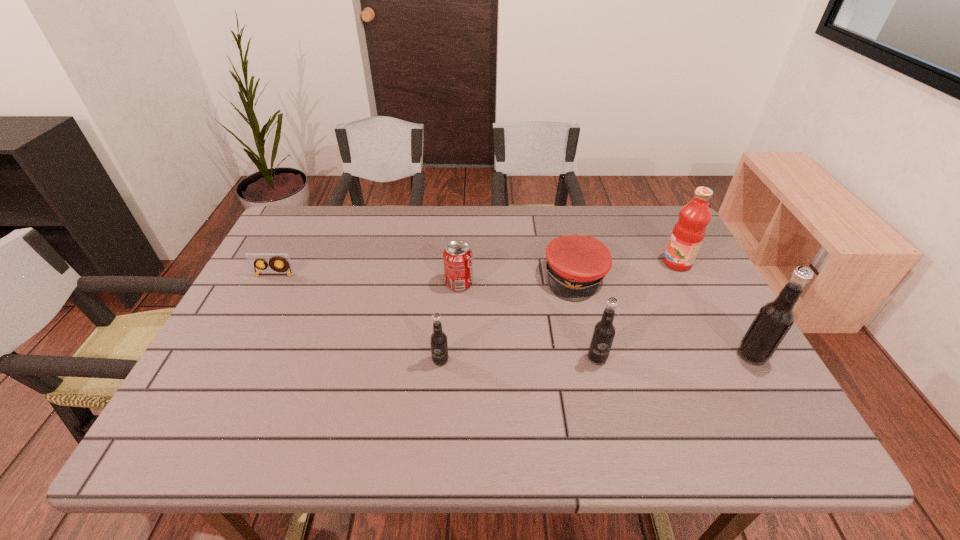
The height and width of the screenshot is (540, 960). In order to click on the shortest root beer in this screenshot , I will do `click(438, 340)`.

Locate an element on the screen. the leftmost root beer is located at coordinates (438, 340).

Find the location of a particular element. The width and height of the screenshot is (960, 540). the second root beer from left to right is located at coordinates (604, 330).

Locate an element on the screen. the fifth shortest object is located at coordinates (604, 330).

Image resolution: width=960 pixels, height=540 pixels. What are the coordinates of `the rightmost root beer` in the screenshot? It's located at (775, 318).

I want to click on the second shortest object, so click(576, 265).

The image size is (960, 540). Identify the location of fruit juice. (689, 231).

Find the location of a particular element. This screenshot has height=540, width=960. soda can is located at coordinates (457, 256).

Locate an element on the screen. the leftmost object is located at coordinates (254, 260).

I want to click on the shortest object, so click(254, 260).